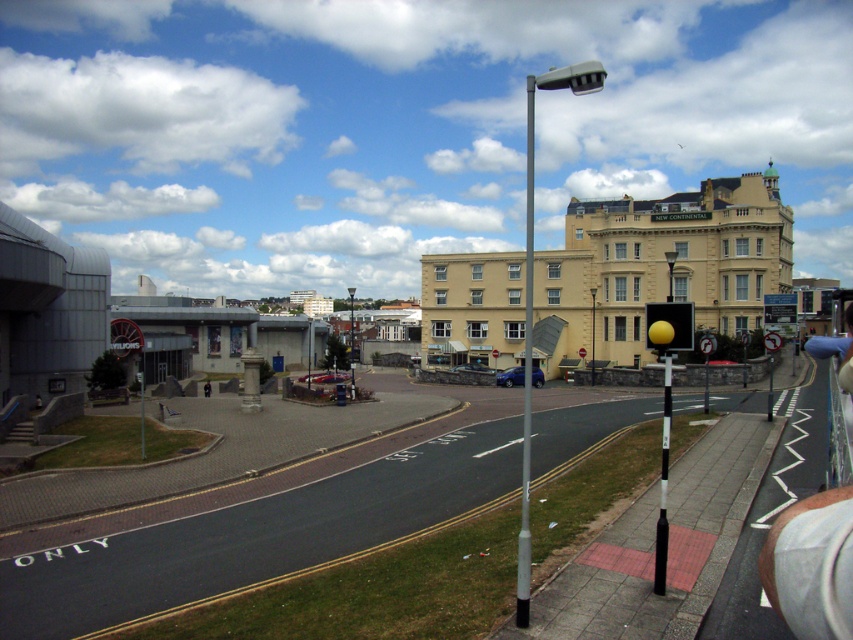
You are standing on the sidewalk in the street scene and want to walk towards the modern building with the curved roof. There are two points marked on the ground ahead of you at coordinates point (682, 305) and point (143, 408). Which point should you step on first to reach the modern building more directly?

You should step on point (682, 305) first because it is closer to you than point (143, 408), so it lies along the direct path toward the modern building.

You are a delivery person who needs to secure a package on the black plastic pole at right and the yellow matte traffic light at center. Which object will require a taller support stand to attach the package?

The black plastic pole at right has a greater height compared to the yellow matte traffic light at center, so the support stand for the black plastic pole at right needs to be taller to accommodate its height.